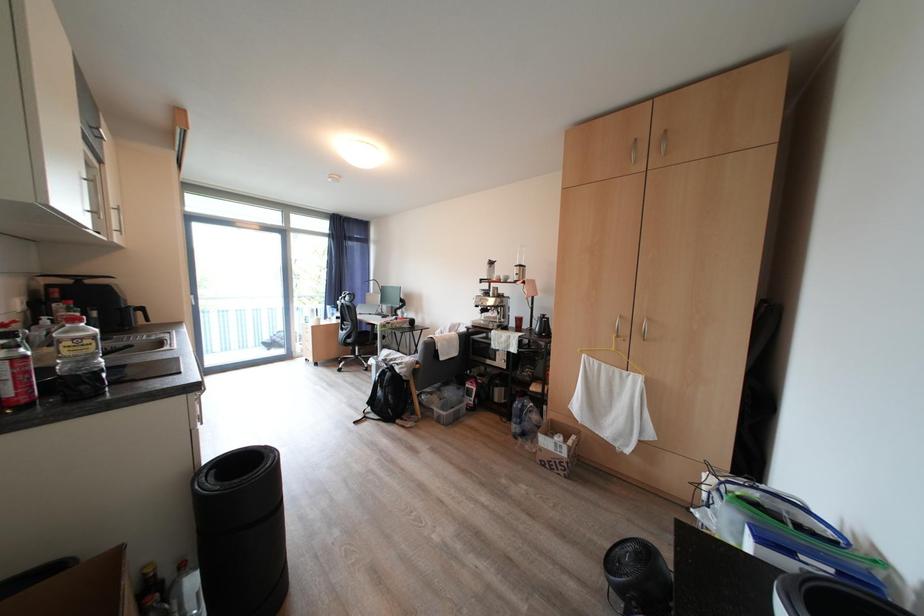
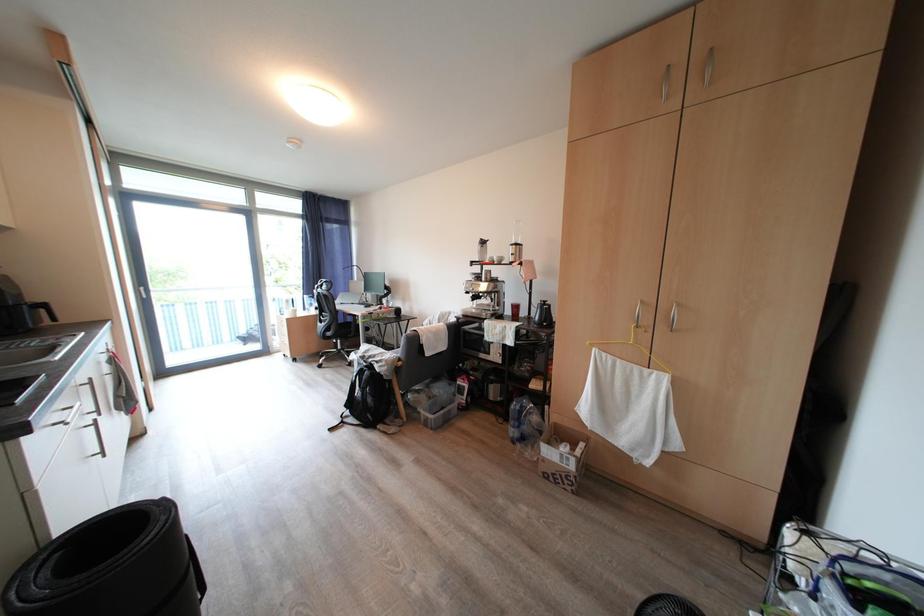
Question: The images are taken continuously from a first-person perspective. In which direction is your viewpoint rotating?

Choices:
 (A) Left
 (B) Right
 (C) Up
 (D) Down

Answer: (D)